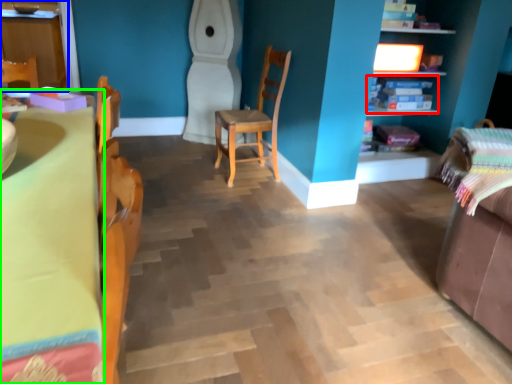
Question: Which object is positioned closest to shelf (highlighted by a red box)? Select from cabinetry (highlighted by a blue box) and table (highlighted by a green box).

Choices:
 (A) cabinetry
 (B) table

Answer: (B)